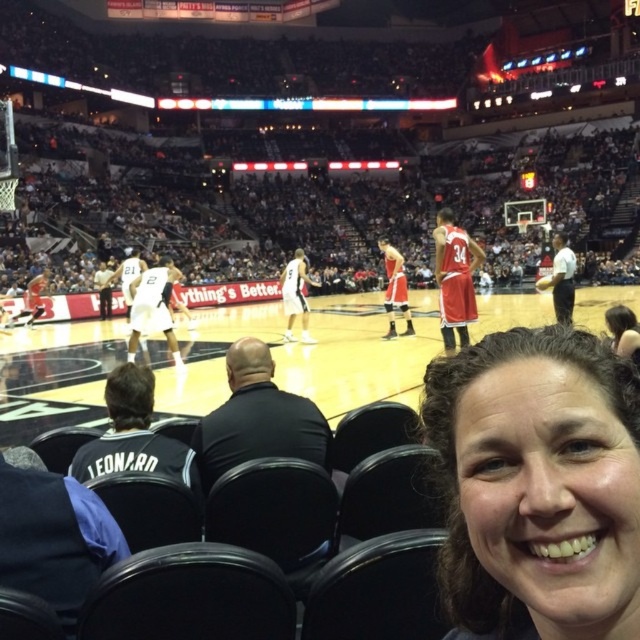
Question: Which point is farther to the camera?

Choices:
 (A) (497, 540)
 (B) (433, 336)

Answer: (B)

Question: Which point is farther to the camera?

Choices:
 (A) wooden basketball court at center
 (B) smooth brown hair at lower right

Answer: (A)

Question: Which point is closer to the camera?

Choices:
 (A) (35, 413)
 (B) (584, 579)

Answer: (B)

Question: Can you confirm if smooth brown hair at lower right is positioned to the left of wooden basketball court at center?

Choices:
 (A) no
 (B) yes

Answer: (B)

Question: Where is smooth brown hair at lower right located in relation to wooden basketball court at center in the image?

Choices:
 (A) left
 (B) right

Answer: (A)

Question: Can you confirm if smooth brown hair at lower right is positioned above wooden basketball court at center?

Choices:
 (A) yes
 (B) no

Answer: (B)